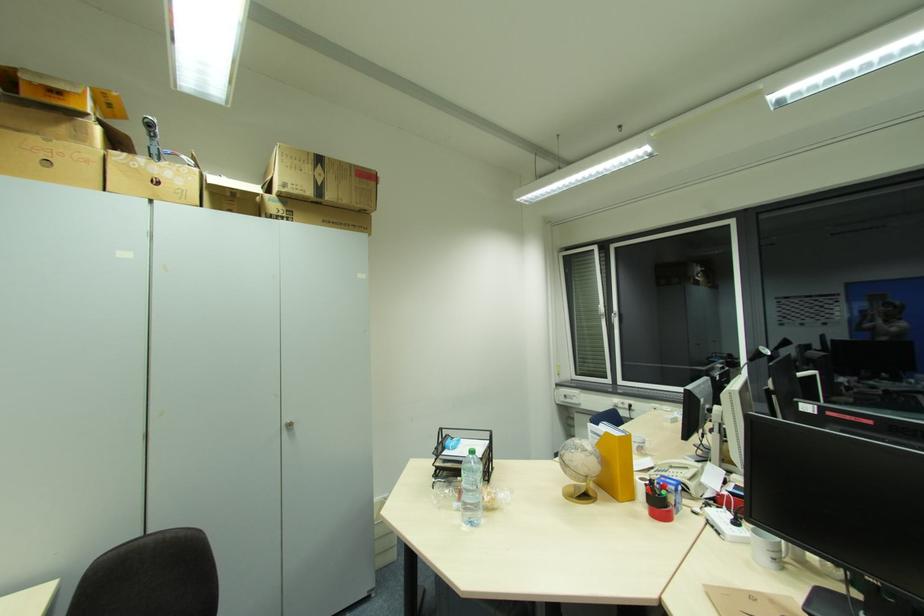
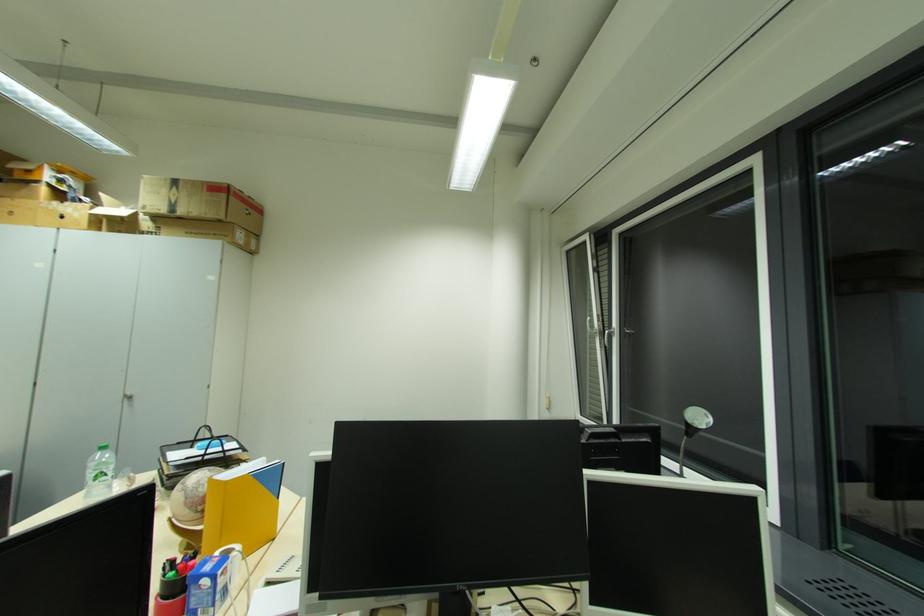
Locate, in the second image, the point that corresponds to (603,322) in the first image.

(600, 342)